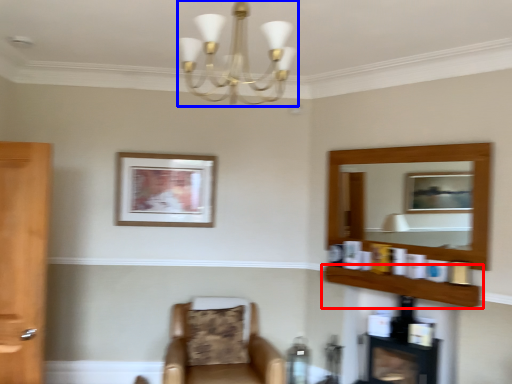
Question: Among these objects, which one is farthest to the camera, shelf (highlighted by a red box) or light fixture (highlighted by a blue box)?

Choices:
 (A) shelf
 (B) light fixture

Answer: (A)